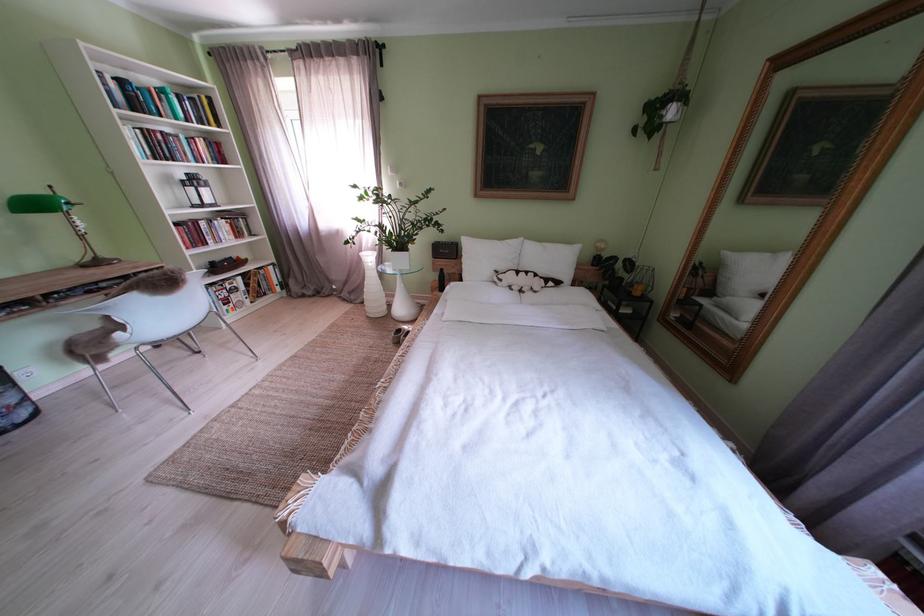
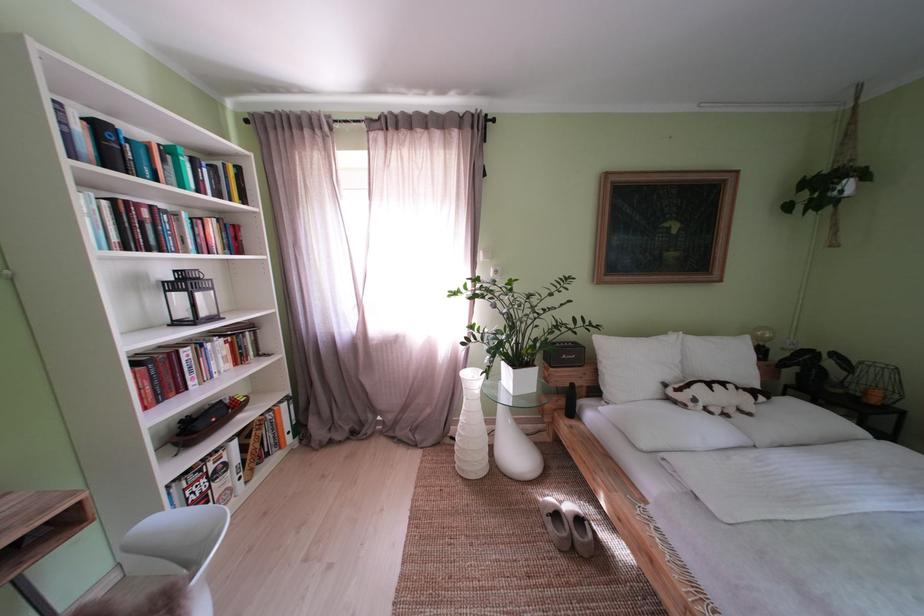
Find the pixel in the second image that matches pixel 205 187 in the first image.

(198, 286)